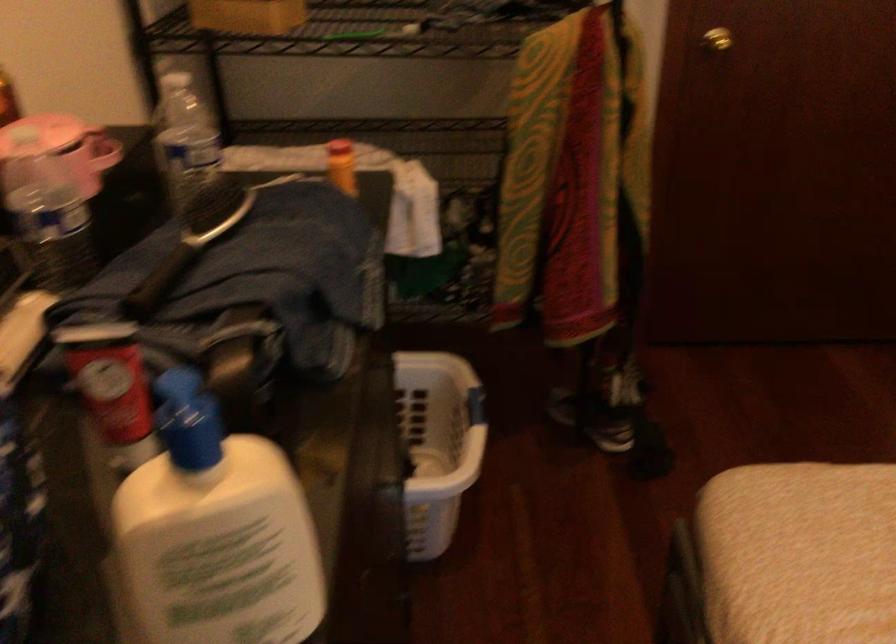
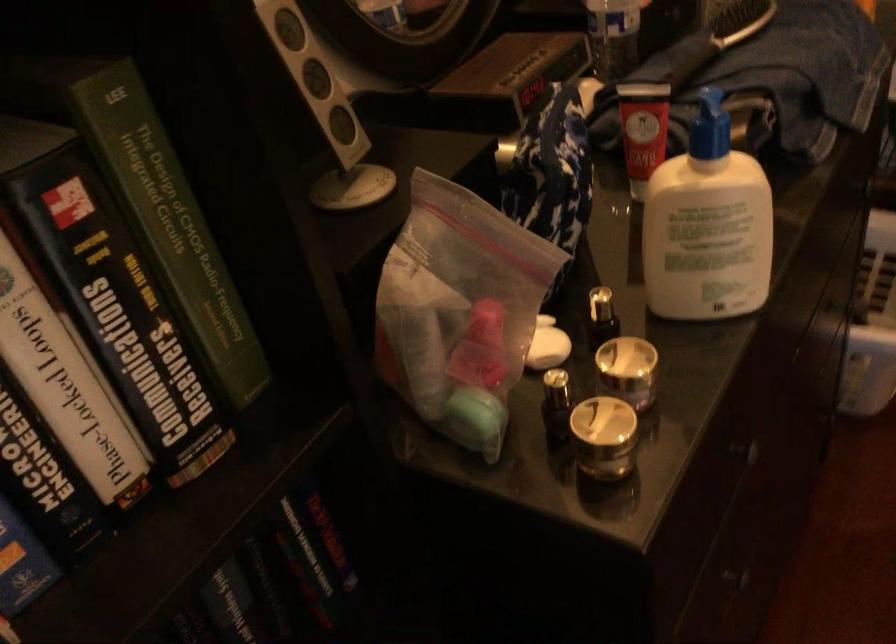
Question: The camera is either moving clockwise (left) or counter-clockwise (right) around the object. The first image is from the beginning of the video and the second image is from the end. Is the camera moving left or right when shooting the video?

Choices:
 (A) Left
 (B) Right

Answer: (B)